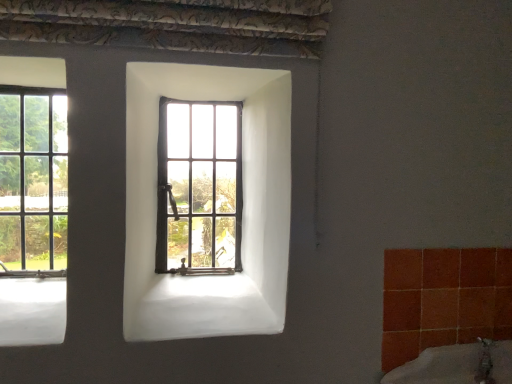
The image size is (512, 384). In order to click on wooden-framed window at center, which is counted as the first window, starting from the right in this screenshot , I will do `click(199, 186)`.

Is clear glass window at left, the 1th window in the left-to-right sequence, in front of wooden-framed window at center, which is counted as the first window, starting from the right?

Yes.

Between clear glass window at left, placed as the second window when sorted from right to left, and wooden-framed window at center, which is counted as the first window, starting from the right, which one appears on the right side from the viewer's perspective?

wooden-framed window at center, which is counted as the first window, starting from the right.

Is clear glass window at left, the 1th window in the left-to-right sequence, facing away from wooden-framed window at center, which is counted as the first window, starting from the right?

clear glass window at left, the 1th window in the left-to-right sequence, is not turned away from wooden-framed window at center, which is counted as the first window, starting from the right.

How different are the orientations of clear glass window at left, the 1th window in the left-to-right sequence, and wooden-framed window at center, which is counted as the first window, starting from the right, in degrees?

clear glass window at left, the 1th window in the left-to-right sequence, and wooden-framed window at center, which is counted as the first window, starting from the right, are facing 0.805 degrees away from each other.

From the image's perspective, which one is positioned lower, white ceramic bath at lower right or wooden-framed window at center, which is counted as the first window, starting from the right?

From the image's view, white ceramic bath at lower right is below.

Are white ceramic bath at lower right and wooden-framed window at center, which is counted as the first window, starting from the right, far apart?

That's not correct — white ceramic bath at lower right is a little close to wooden-framed window at center, which is counted as the first window, starting from the right.

Is white ceramic bath at lower right oriented away from wooden-framed window at center, which is counted as the first window, starting from the right?

No, white ceramic bath at lower right is not facing the opposite direction of wooden-framed window at center, which is counted as the first window, starting from the right.

Is wooden-framed window at center, the 2th window when ordered from left to right, inside white ceramic bath at lower right?

Actually, wooden-framed window at center, the 2th window when ordered from left to right, is outside white ceramic bath at lower right.

Is wooden-framed window at center, which is counted as the first window, starting from the right, positioned with its back to clear glass window at left, the 1th window in the left-to-right sequence?

wooden-framed window at center, which is counted as the first window, starting from the right, does not have its back to clear glass window at left, the 1th window in the left-to-right sequence.

From the picture: Which is more to the left, wooden-framed window at center, the 2th window when ordered from left to right, or clear glass window at left, the 1th window in the left-to-right sequence?

clear glass window at left, the 1th window in the left-to-right sequence.

Looking at this image, is wooden-framed window at center, the 2th window when ordered from left to right, far from clear glass window at left, placed as the second window when sorted from right to left?

That's not correct — wooden-framed window at center, the 2th window when ordered from left to right, is a little close to clear glass window at left, placed as the second window when sorted from right to left.

Considering the positions of objects wooden-framed window at center, the 2th window when ordered from left to right, and clear glass window at left, placed as the second window when sorted from right to left, in the image provided, who is behind, wooden-framed window at center, the 2th window when ordered from left to right, or clear glass window at left, placed as the second window when sorted from right to left,?

wooden-framed window at center, the 2th window when ordered from left to right.

Considering the positions of objects white ceramic bath at lower right and clear glass window at left, the 1th window in the left-to-right sequence, in the image provided, who is more to the right, white ceramic bath at lower right or clear glass window at left, the 1th window in the left-to-right sequence,?

white ceramic bath at lower right.

From a real-world perspective, is white ceramic bath at lower right positioned under clear glass window at left, placed as the second window when sorted from right to left, based on gravity?

Indeed, from a real-world perspective, white ceramic bath at lower right is positioned beneath clear glass window at left, placed as the second window when sorted from right to left.

Looking at their sizes, would you say white ceramic bath at lower right is wider or thinner than clear glass window at left, placed as the second window when sorted from right to left?

Clearly, white ceramic bath at lower right has more width compared to clear glass window at left, placed as the second window when sorted from right to left.

Can we say white ceramic bath at lower right lies outside clear glass window at left, the 1th window in the left-to-right sequence?

white ceramic bath at lower right lies outside clear glass window at left, the 1th window in the left-to-right sequence,'s area.

Who is smaller, clear glass window at left, placed as the second window when sorted from right to left, or white ceramic bath at lower right?

clear glass window at left, placed as the second window when sorted from right to left, is smaller.

Locate an element on the screen. the 2nd window positioned above the white ceramic bath at lower right (from the image's perspective) is located at coordinates (33, 200).

Which is behind, point (52, 312) or point (451, 382)?

The point (451, 382) is more distant.

From the image's perspective, is clear glass window at left, placed as the second window when sorted from right to left, below white ceramic bath at lower right?

Incorrect, from the image's perspective, clear glass window at left, placed as the second window when sorted from right to left, is higher than white ceramic bath at lower right.

From the image's perspective, is wooden-framed window at center, which is counted as the first window, starting from the right, located above or below white ceramic bath at lower right?

wooden-framed window at center, which is counted as the first window, starting from the right, is above white ceramic bath at lower right.

In the scene shown: In terms of size, does wooden-framed window at center, which is counted as the first window, starting from the right, appear bigger or smaller than white ceramic bath at lower right?

In the image, wooden-framed window at center, which is counted as the first window, starting from the right, appears to be smaller than white ceramic bath at lower right.

Can you confirm if wooden-framed window at center, the 2th window when ordered from left to right, is wider than white ceramic bath at lower right?

No.

I want to click on window located in front of the wooden-framed window at center, the 2th window when ordered from left to right, so click(33, 200).

Where is `the 1st window above when counting from the white ceramic bath at lower right (from the image's perspective)`? Image resolution: width=512 pixels, height=384 pixels. the 1st window above when counting from the white ceramic bath at lower right (from the image's perspective) is located at coordinates (199, 186).

From the picture: Looking at the image, which one is located closer to wooden-framed window at center, the 2th window when ordered from left to right, clear glass window at left, the 1th window in the left-to-right sequence, or white ceramic bath at lower right?

The object closer to wooden-framed window at center, the 2th window when ordered from left to right, is clear glass window at left, the 1th window in the left-to-right sequence.

When comparing their distances from white ceramic bath at lower right, does clear glass window at left, the 1th window in the left-to-right sequence, or wooden-framed window at center, the 2th window when ordered from left to right, seem further?

clear glass window at left, the 1th window in the left-to-right sequence, lies further to white ceramic bath at lower right than the other object.

When comparing their distances from clear glass window at left, the 1th window in the left-to-right sequence, does wooden-framed window at center, the 2th window when ordered from left to right, or white ceramic bath at lower right seem closer?

Among the two, wooden-framed window at center, the 2th window when ordered from left to right, is located nearer to clear glass window at left, the 1th window in the left-to-right sequence.

Considering their positions, is white ceramic bath at lower right positioned closer to clear glass window at left, the 1th window in the left-to-right sequence, than wooden-framed window at center, which is counted as the first window, starting from the right?

Based on the image, wooden-framed window at center, which is counted as the first window, starting from the right, appears to be nearer to clear glass window at left, the 1th window in the left-to-right sequence.

Looking at the image, which one is located closer to white ceramic bath at lower right, wooden-framed window at center, the 2th window when ordered from left to right, or clear glass window at left, placed as the second window when sorted from right to left?

wooden-framed window at center, the 2th window when ordered from left to right, is closer to white ceramic bath at lower right.

From the image, which object appears to be nearer to wooden-framed window at center, the 2th window when ordered from left to right, white ceramic bath at lower right or clear glass window at left, the 1th window in the left-to-right sequence?

The object closer to wooden-framed window at center, the 2th window when ordered from left to right, is clear glass window at left, the 1th window in the left-to-right sequence.

I want to click on window situated between clear glass window at left, placed as the second window when sorted from right to left, and white ceramic bath at lower right from left to right, so click(x=199, y=186).